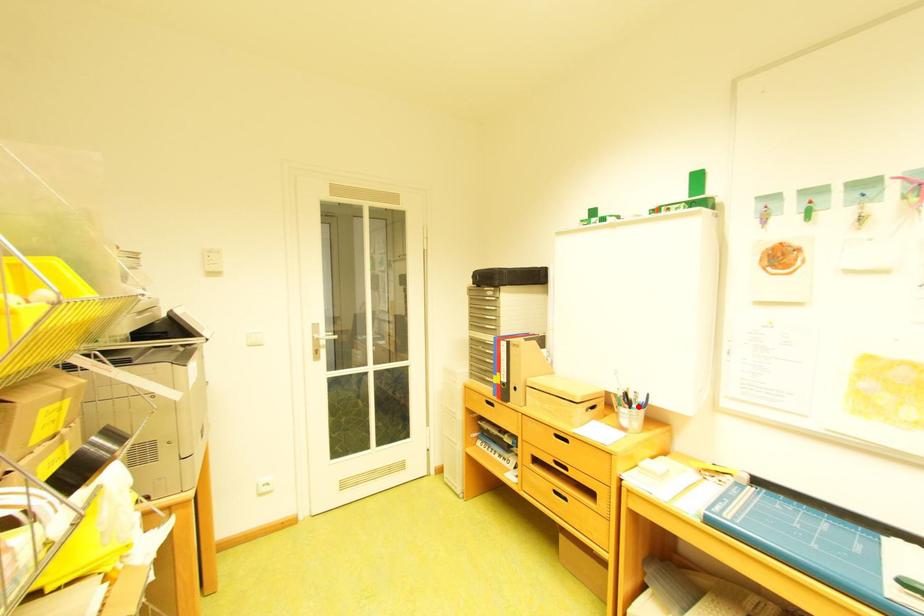
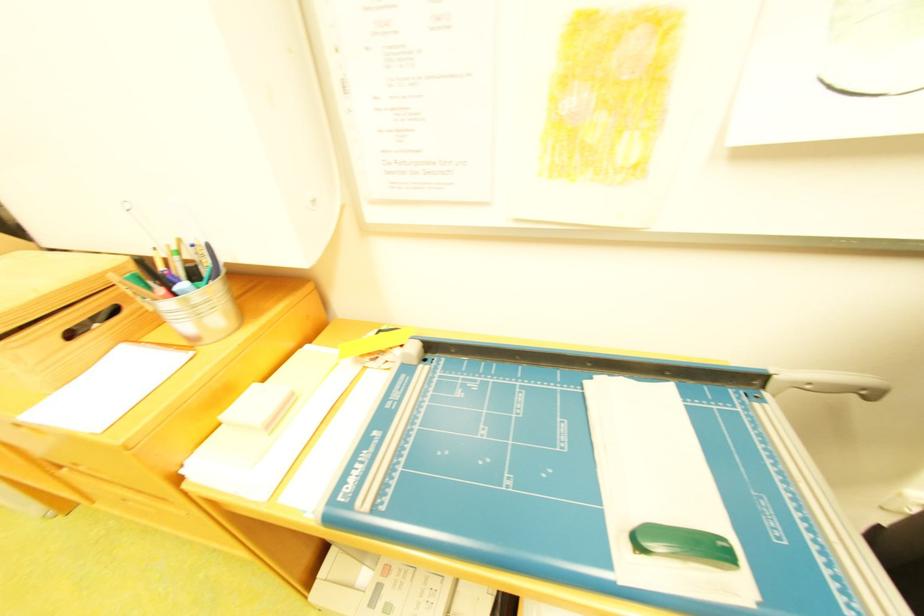
In the second image, find the point that corresponds to the highlighted location in the first image.

(173, 292)